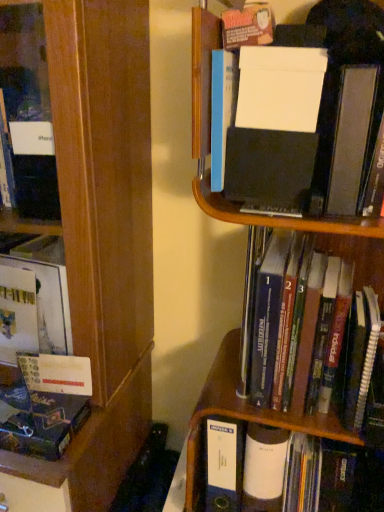
What is the approximate width of hardcover book at center, the 1th book positioned from the right?

It is 11.04 inches.

The width and height of the screenshot is (384, 512). What do you see at coordinates (85, 227) in the screenshot?
I see `wooden bookcase at left` at bounding box center [85, 227].

This screenshot has height=512, width=384. Describe the element at coordinates (270, 127) in the screenshot. I see `white matte folder at upper right, marked as the 2th book in a right-to-left arrangement` at that location.

What are the coordinates of `matte black book at lower left, marked as the 3th book in a top-to-bottom arrangement` in the screenshot? It's located at (39, 421).

The height and width of the screenshot is (512, 384). What are the coordinates of `hardcover book at center, which is the second book in bottom-to-top order` in the screenshot? It's located at (293, 313).

From a real-world perspective, is wooden bookcase at left on hardcover book at center, the 1th book positioned from the right?

No, from a real-world perspective, wooden bookcase at left is not above hardcover book at center, the 1th book positioned from the right.

Are wooden bookcase at left and hardcover book at center, the 1th book positioned from the right, far apart?

That's not correct — wooden bookcase at left is a little close to hardcover book at center, the 1th book positioned from the right.

Image resolution: width=384 pixels, height=512 pixels. I want to click on bookcase lying on the left of hardcover book at center, the 3th book from the left, so [x=85, y=227].

Which of these two, wooden bookcase at left or hardcover book at center, which is the second book in bottom-to-top order, is wider?

wooden bookcase at left is wider.

Considering the sizes of objects white matte folder at upper right, marked as the 2th book in a right-to-left arrangement, and hardcover book at center, which ranks as the 2th book in top-to-bottom order, in the image provided, who is smaller, white matte folder at upper right, marked as the 2th book in a right-to-left arrangement, or hardcover book at center, which ranks as the 2th book in top-to-bottom order,?

Smaller between the two is white matte folder at upper right, marked as the 2th book in a right-to-left arrangement.

Can you tell me how much white matte folder at upper right, which is counted as the second book, starting from the left, and hardcover book at center, which ranks as the 2th book in top-to-bottom order, differ in facing direction?

They differ by 5.84 degrees in their facing directions.

Can we say white matte folder at upper right, which is counted as the second book, starting from the left, lies outside hardcover book at center, which ranks as the 2th book in top-to-bottom order?

white matte folder at upper right, which is counted as the second book, starting from the left, lies outside hardcover book at center, which ranks as the 2th book in top-to-bottom order,'s area.

Considering the sizes of wooden bookcase at left and white matte folder at upper right, the 1th book in the top-to-bottom sequence, in the image, is wooden bookcase at left taller or shorter than white matte folder at upper right, the 1th book in the top-to-bottom sequence,?

In the image, wooden bookcase at left appears to be taller than white matte folder at upper right, the 1th book in the top-to-bottom sequence.

From a real-world perspective, relative to white matte folder at upper right, the 1th book in the top-to-bottom sequence, is wooden bookcase at left vertically above or below?

In terms of real-world spatial position, wooden bookcase at left is below white matte folder at upper right, the 1th book in the top-to-bottom sequence.

Which point is more distant from viewer, (118,276) or (297,125)?

Positioned behind is point (118,276).

Is wooden bookcase at left touching white matte folder at upper right, marked as the 2th book in a right-to-left arrangement?

No, wooden bookcase at left is not with white matte folder at upper right, marked as the 2th book in a right-to-left arrangement.

Is matte black book at lower left, which appears as the third book when viewed from the right, next to wooden bookcase at left and touching it?

They are not placed beside each other.

Measure the distance between matte black book at lower left, the first book in the left-to-right sequence, and wooden bookcase at left.

matte black book at lower left, the first book in the left-to-right sequence, is 30.57 centimeters away from wooden bookcase at left.

Is matte black book at lower left, marked as the 3th book in a top-to-bottom arrangement, further to the viewer compared to wooden bookcase at left?

Yes, it is.

From the image's perspective, is matte black book at lower left, which appears as the third book when viewed from the right, located beneath wooden bookcase at left?

Indeed, from the image's perspective, matte black book at lower left, which appears as the third book when viewed from the right, is shown beneath wooden bookcase at left.

Is hardcover book at center, the 1th book positioned from the right, turned away from wooden bookcase at left?

No, hardcover book at center, the 1th book positioned from the right,'s orientation is not away from wooden bookcase at left.

What are the coordinates of `bookcase on the left of hardcover book at center, which ranks as the 2th book in top-to-bottom order` in the screenshot? It's located at (85, 227).

Considering the relative sizes of hardcover book at center, which ranks as the 2th book in top-to-bottom order, and wooden bookcase at left in the image provided, is hardcover book at center, which ranks as the 2th book in top-to-bottom order, taller than wooden bookcase at left?

No, hardcover book at center, which ranks as the 2th book in top-to-bottom order, is not taller than wooden bookcase at left.

Is hardcover book at center, the 1th book positioned from the right, surrounding wooden bookcase at left?

No, wooden bookcase at left is located outside of hardcover book at center, the 1th book positioned from the right.

From the image's perspective, between hardcover book at center, the 3th book from the left, and matte black book at lower left, which is the 1th book in bottom-to-top order, which one is located above?

hardcover book at center, the 3th book from the left.

Which of these two, hardcover book at center, which ranks as the 2th book in top-to-bottom order, or matte black book at lower left, which appears as the third book when viewed from the right, stands taller?

hardcover book at center, which ranks as the 2th book in top-to-bottom order.

Is hardcover book at center, the 1th book positioned from the right, positioned with its back to matte black book at lower left, the first book in the left-to-right sequence?

No, matte black book at lower left, the first book in the left-to-right sequence, is not at the back of hardcover book at center, the 1th book positioned from the right.

Which object is wider, hardcover book at center, the 3th book from the left, or matte black book at lower left, the first book in the left-to-right sequence?

With larger width is hardcover book at center, the 3th book from the left.

Who is bigger, wooden bookcase at left or matte black book at lower left, which is the 1th book in bottom-to-top order?

wooden bookcase at left is bigger.

Is wooden bookcase at left facing towards matte black book at lower left, marked as the 3th book in a top-to-bottom arrangement?

Yes.

Which is more to the left, wooden bookcase at left or matte black book at lower left, marked as the 3th book in a top-to-bottom arrangement?

Positioned to the left is wooden bookcase at left.

Is wooden bookcase at left directly adjacent to matte black book at lower left, marked as the 3th book in a top-to-bottom arrangement?

wooden bookcase at left and matte black book at lower left, marked as the 3th book in a top-to-bottom arrangement, are clearly separated.

Identify the location of the 2nd book behind when counting from the wooden bookcase at left. (293, 313).

From the image's perspective, starting from the white matte folder at upper right, marked as the 2th book in a right-to-left arrangement, which book is the 1st one below? Please provide its 2D coordinates.

[(293, 313)]

Which object lies nearer to the anchor point white matte folder at upper right, the 1th book in the top-to-bottom sequence, wooden bookcase at left or matte black book at lower left, the first book in the left-to-right sequence?

wooden bookcase at left lies closer to white matte folder at upper right, the 1th book in the top-to-bottom sequence, than the other object.

Looking at the image, which one is located further to wooden bookcase at left, hardcover book at center, which ranks as the 2th book in top-to-bottom order, or white matte folder at upper right, the 1th book in the top-to-bottom sequence?

white matte folder at upper right, the 1th book in the top-to-bottom sequence, is further to wooden bookcase at left.

From the image, which object appears to be nearer to wooden bookcase at left, hardcover book at center, the 1th book positioned from the right, or matte black book at lower left, which is the 1th book in bottom-to-top order?

matte black book at lower left, which is the 1th book in bottom-to-top order, is positioned closer to the anchor wooden bookcase at left.

Estimate the real-world distances between objects in this image. Which object is further from white matte folder at upper right, the 1th book in the top-to-bottom sequence, wooden bookcase at left or hardcover book at center, which ranks as the 2th book in top-to-bottom order?

wooden bookcase at left.

Estimate the real-world distances between objects in this image. Which object is further from white matte folder at upper right, arranged as the third book when ordered from the bottom, hardcover book at center, which ranks as the 2th book in top-to-bottom order, or matte black book at lower left, the first book in the left-to-right sequence?

The object further to white matte folder at upper right, arranged as the third book when ordered from the bottom, is matte black book at lower left, the first book in the left-to-right sequence.

From the image, which object appears to be farther from matte black book at lower left, which appears as the third book when viewed from the right, white matte folder at upper right, marked as the 2th book in a right-to-left arrangement, or wooden bookcase at left?

The object further to matte black book at lower left, which appears as the third book when viewed from the right, is white matte folder at upper right, marked as the 2th book in a right-to-left arrangement.

Estimate the real-world distances between objects in this image. Which object is closer to wooden bookcase at left, white matte folder at upper right, marked as the 2th book in a right-to-left arrangement, or hardcover book at center, the 1th book positioned from the right?

hardcover book at center, the 1th book positioned from the right, lies closer to wooden bookcase at left than the other object.

From the image, which object appears to be farther from matte black book at lower left, marked as the 3th book in a top-to-bottom arrangement, hardcover book at center, the 3th book from the left, or white matte folder at upper right, which is counted as the second book, starting from the left?

white matte folder at upper right, which is counted as the second book, starting from the left.

This screenshot has width=384, height=512. What are the coordinates of `bookcase between white matte folder at upper right, the 1th book in the top-to-bottom sequence, and matte black book at lower left, the first book in the left-to-right sequence, from top to bottom` in the screenshot? It's located at (85, 227).

The width and height of the screenshot is (384, 512). I want to click on book between white matte folder at upper right, arranged as the third book when ordered from the bottom, and matte black book at lower left, marked as the 3th book in a top-to-bottom arrangement, vertically, so click(293, 313).